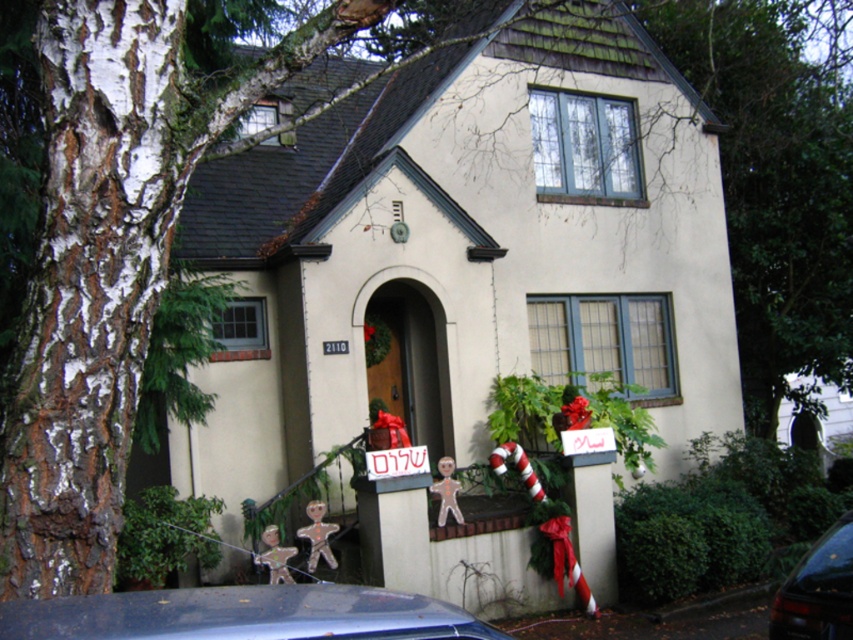
You are standing in front of the house and see a point marked at coordinates (244, 614). Based on the scene description, what object is located at that point?

The point at coordinates (244, 614) is on the metallic blue car at lower left.

You are standing at the entrance of the house and want to park your metallic blue car at lower left. What are the coordinates where you should position it?

The metallic blue car at lower left should be positioned at coordinates point [244,614].